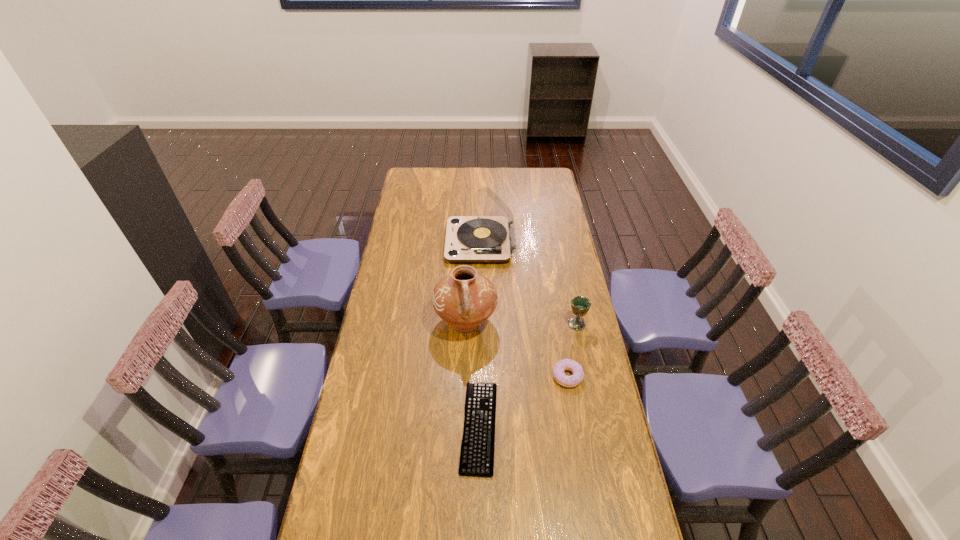
What are the coordinates of `vacant area that lies between the doughnut and the computer keyboard` in the screenshot? It's located at (523, 401).

Locate an element on the screen. vacant area that lies between the record player and the third shortest object is located at coordinates (529, 284).

Where is `unoccupied area between the pottery and the chalice`? The height and width of the screenshot is (540, 960). unoccupied area between the pottery and the chalice is located at coordinates (521, 323).

Image resolution: width=960 pixels, height=540 pixels. Find the location of `vacant area that lies between the doughnut and the pottery`. vacant area that lies between the doughnut and the pottery is located at coordinates (516, 349).

Find the location of `free space between the pottery and the doughnut`. free space between the pottery and the doughnut is located at coordinates (516, 349).

I want to click on free spot between the chalice and the pottery, so click(x=521, y=323).

You are a GUI agent. You are given a task and a screenshot of the screen. Output one action in this format:
    pyautogui.click(x=<x>, y=<y>)
    Task: Click on the blank region between the doughnut and the computer keyboard
    The image size is (960, 540).
    Given the screenshot: What is the action you would take?
    pyautogui.click(x=523, y=401)

Locate an element on the screen. object that is the closest to the shortest object is located at coordinates (464, 299).

I want to click on the closest object to the shortest object, so click(x=464, y=299).

The height and width of the screenshot is (540, 960). What are the coordinates of `free region that satisfies the following two spatial constraints: 1. on the side of the shortest object with the handle; 2. on the left side of the pottery` in the screenshot? It's located at (463, 427).